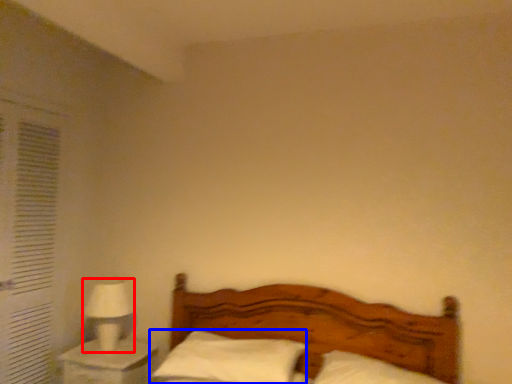
Question: Which of the following is the farthest to the observer, table lamp (highlighted by a red box) or pillow (highlighted by a blue box)?

Choices:
 (A) table lamp
 (B) pillow

Answer: (A)